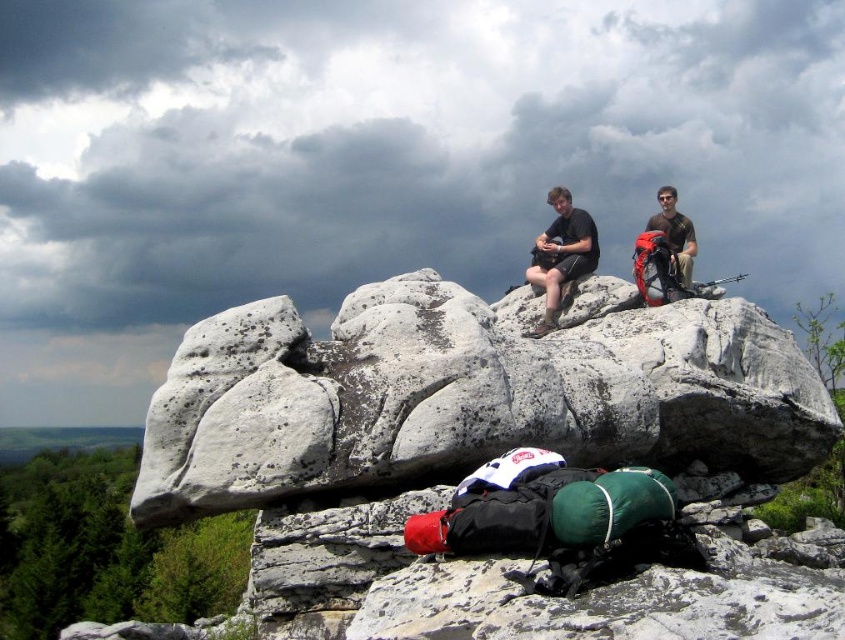
Question: Can you confirm if matte black shorts at center is positioned below brown cotton shirt at upper right?

Choices:
 (A) no
 (B) yes

Answer: (B)

Question: Which object is positioned farthest from the matte black backpacks at center?

Choices:
 (A) brown cotton shirt at upper right
 (B) matte black shorts at center

Answer: (B)

Question: Does white rough rock at center come behind matte black backpacks at center?

Choices:
 (A) yes
 (B) no

Answer: (B)

Question: Where is white rough rock at center located in relation to brown cotton shirt at upper right in the image?

Choices:
 (A) above
 (B) below

Answer: (B)

Question: Which of these objects is positioned farthest from the matte black backpacks at center?

Choices:
 (A) brown cotton shirt at upper right
 (B) matte black shorts at center

Answer: (B)

Question: Which point is farther to the camera?

Choices:
 (A) matte black backpacks at center
 (B) brown cotton shirt at upper right
 (C) white rough rock at center

Answer: (B)